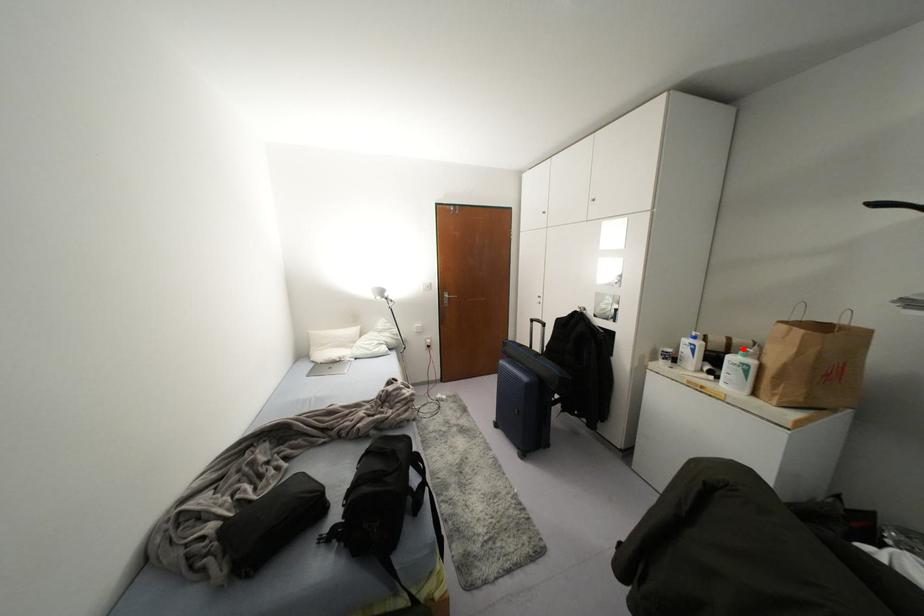
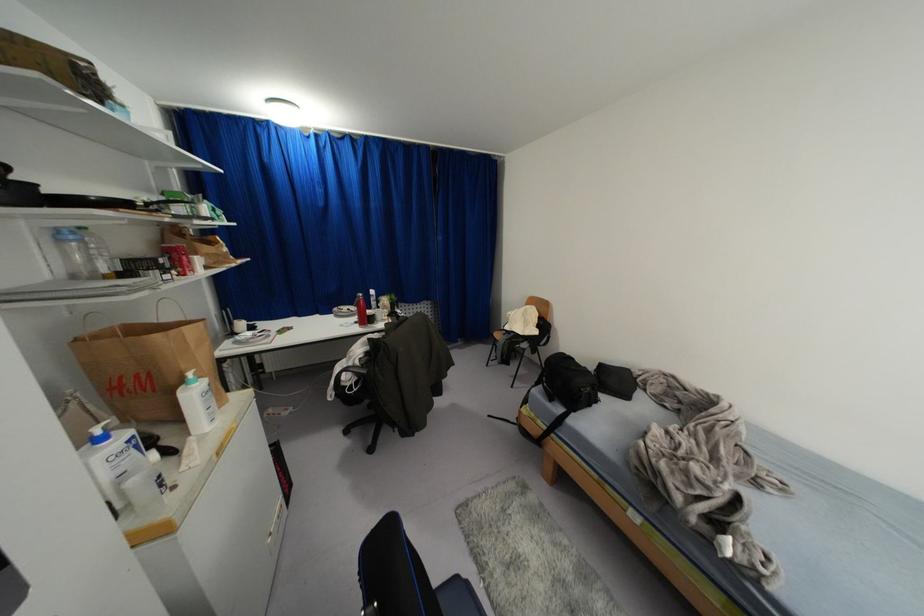
Locate, in the second image, the point that corresponds to the highlighted location in the first image.

(189, 374)